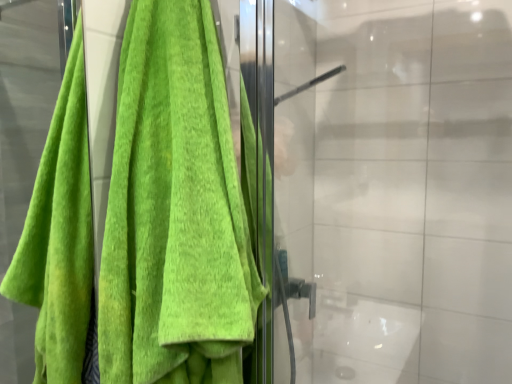
What is the approximate width of green terry cloth towel at left?

green terry cloth towel at left is 11.22 inches wide.

The image size is (512, 384). In order to click on green terry cloth towel at left in this screenshot , I will do `click(175, 211)`.

Image resolution: width=512 pixels, height=384 pixels. What do you see at coordinates (175, 211) in the screenshot?
I see `green terry cloth towel at left` at bounding box center [175, 211].

Describe the element at coordinates (397, 188) in the screenshot. This screenshot has width=512, height=384. I see `transparent glass door at center` at that location.

Identify the location of transparent glass door at center. (x=397, y=188).

Where is `green terry cloth towel at left`? green terry cloth towel at left is located at coordinates click(x=175, y=211).

Looking at this image, can you confirm if transparent glass door at center is positioned to the left of green terry cloth towel at left?

No, transparent glass door at center is not to the left of green terry cloth towel at left.

Which is in front, transparent glass door at center or green terry cloth towel at left?

green terry cloth towel at left is in front.

Considering the points (485, 228) and (139, 276), which point is behind, point (485, 228) or point (139, 276)?

The point (139, 276) is farther from the camera.

From the image's perspective, which one is positioned higher, transparent glass door at center or green terry cloth towel at left?

green terry cloth towel at left, from the image's perspective.

From a real-world perspective, is transparent glass door at center below green terry cloth towel at left?

Yes, from a real-world perspective, transparent glass door at center is below green terry cloth towel at left.

Which object is thinner, transparent glass door at center or green terry cloth towel at left?

green terry cloth towel at left.

Considering the relative sizes of transparent glass door at center and green terry cloth towel at left in the image provided, is transparent glass door at center shorter than green terry cloth towel at left?

Incorrect, the height of transparent glass door at center does not fall short of that of green terry cloth towel at left.

Looking at the image, does transparent glass door at center seem bigger or smaller compared to green terry cloth towel at left?

Clearly, transparent glass door at center is larger in size than green terry cloth towel at left.

Is green terry cloth towel at left a part of transparent glass door at center?

Actually, green terry cloth towel at left is outside transparent glass door at center.

Is transparent glass door at center beside green terry cloth towel at left?

A: They are not placed beside each other.

Does transparent glass door at center turn towards green terry cloth towel at left?

No, transparent glass door at center does not turn towards green terry cloth towel at left.

I want to click on glass door that appears behind the green terry cloth towel at left, so click(x=397, y=188).

Is green terry cloth towel at left at the right side of transparent glass door at center?

Incorrect, green terry cloth towel at left is not on the right side of transparent glass door at center.

Is green terry cloth towel at left positioned in front of transparent glass door at center?

Yes, green terry cloth towel at left is closer to the viewer.

Does point (152, 342) come behind point (436, 356)?

No, it is in front of (436, 356).

From the image's perspective, is green terry cloth towel at left located above or below transparent glass door at center?

green terry cloth towel at left is above transparent glass door at center.

From a real-world perspective, is green terry cloth towel at left beneath transparent glass door at center?

No, from a real-world perspective, green terry cloth towel at left is not below transparent glass door at center.

Looking at this image, in terms of width, does green terry cloth towel at left look wider or thinner when compared to transparent glass door at center?

Clearly, green terry cloth towel at left has less width compared to transparent glass door at center.

Considering the relative sizes of green terry cloth towel at left and transparent glass door at center in the image provided, is green terry cloth towel at left shorter than transparent glass door at center?

Correct, green terry cloth towel at left is not as tall as transparent glass door at center.

Based on the photo, between green terry cloth towel at left and transparent glass door at center, which one has smaller size?

green terry cloth towel at left is smaller.

Is green terry cloth towel at left outside of transparent glass door at center?

Yes.

Is green terry cloth towel at left not near transparent glass door at center?

No.

Is transparent glass door at center at the back of green terry cloth towel at left?

That's not correct — green terry cloth towel at left is not looking away from transparent glass door at center.

How distant is green terry cloth towel at left from transparent glass door at center?

63.51 centimeters.

I want to click on glass door below the green terry cloth towel at left (from a real-world perspective), so click(397, 188).

What are the coordinates of `towel that is in front of the transparent glass door at center` in the screenshot? It's located at (175, 211).

Locate an element on the screen. glass door below the green terry cloth towel at left (from a real-world perspective) is located at coordinates (397, 188).